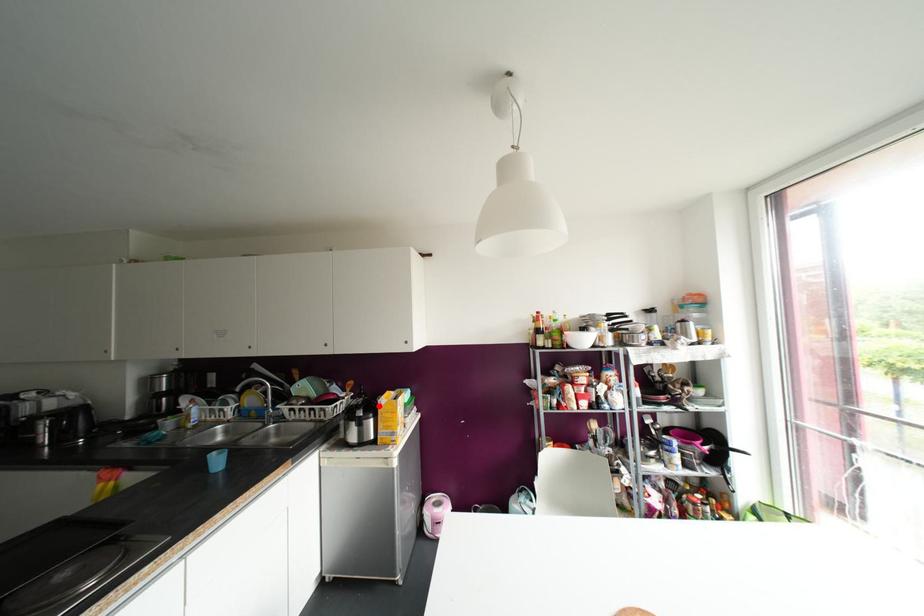
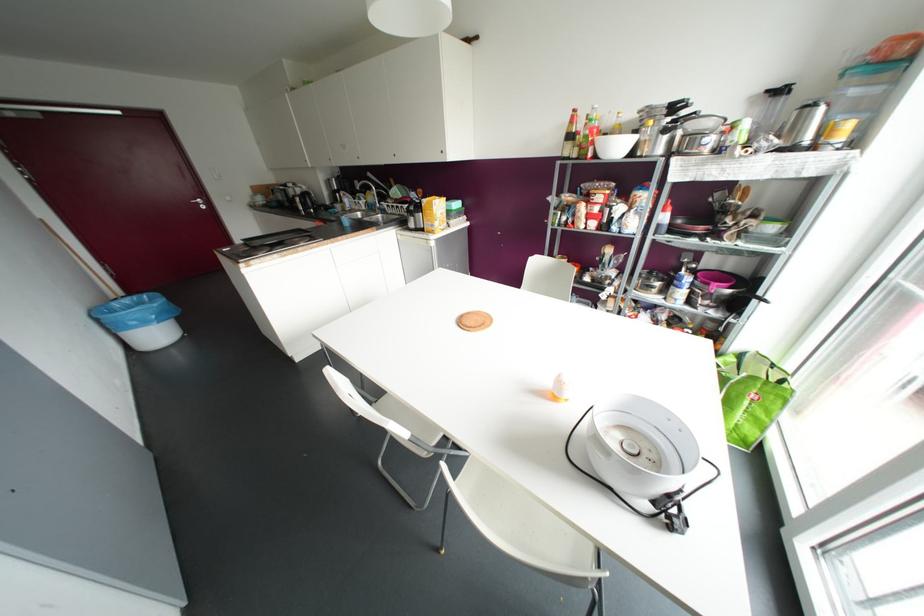
In the second image, find the point that corresponds to the highlighted location in the first image.

(421, 204)